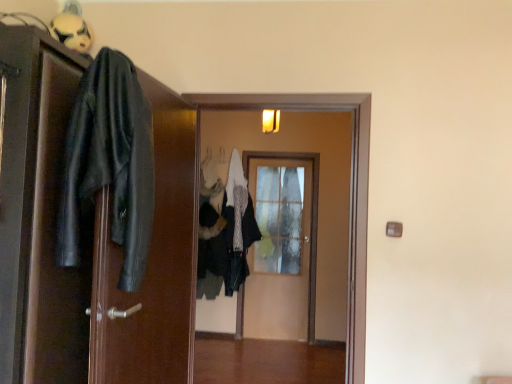
The image size is (512, 384). I want to click on black leather jacket at left, so click(x=152, y=263).

The height and width of the screenshot is (384, 512). Describe the element at coordinates (281, 249) in the screenshot. I see `wooden glass door at center, which ranks as the first door in back-to-front order` at that location.

Locate an element on the screen. The image size is (512, 384). white matte mask at upper left is located at coordinates [x=71, y=28].

Where is `white textured coat at center, which is the 2th clothing in front-to-back order`? The image size is (512, 384). white textured coat at center, which is the 2th clothing in front-to-back order is located at coordinates (225, 232).

The height and width of the screenshot is (384, 512). What do you see at coordinates (225, 232) in the screenshot?
I see `white textured coat at center, the 1th clothing when ordered from back to front` at bounding box center [225, 232].

The height and width of the screenshot is (384, 512). I want to click on black leather jacket at left, so click(152, 263).

Can you confirm if black leather jacket at left, which is the 2th clothing in back-to-front order, is shorter than black leather jacket at left?

Yes.

Which of these two, black leather jacket at left, which ranks as the first clothing in left-to-right order, or black leather jacket at left, is wider?

black leather jacket at left, which ranks as the first clothing in left-to-right order.

Is black leather jacket at left, positioned as the 2th clothing in right-to-left order, positioned with its back to black leather jacket at left?

Yes.

Which object is further away from the camera, black leather jacket at left, which ranks as the first clothing in left-to-right order, or black leather jacket at left?

black leather jacket at left.

Considering the positions of objects black leather jacket at left, the 1th door positioned from the left, and white matte mask at upper left in the image provided, who is more to the right, black leather jacket at left, the 1th door positioned from the left, or white matte mask at upper left?

From the viewer's perspective, black leather jacket at left, the 1th door positioned from the left, appears more on the right side.

Is black leather jacket at left, which is the third door from back to front, oriented towards white matte mask at upper left?

No, black leather jacket at left, which is the third door from back to front, is not oriented towards white matte mask at upper left.

Could you measure the distance between black leather jacket at left, the first door from the front, and white matte mask at upper left?

They are 3.40 feet apart.

Is black leather jacket at left, the first door from the front, taller or shorter than white matte mask at upper left?

Considering their sizes, black leather jacket at left, the first door from the front, has more height than white matte mask at upper left.

Is there a large distance between black leather jacket at left, the first door from the front, and black leather jacket at left, which is the 2th clothing in back-to-front order?

No, black leather jacket at left, the first door from the front, is in close proximity to black leather jacket at left, which is the 2th clothing in back-to-front order.

In the scene shown: From a real-world perspective, between black leather jacket at left, the 3th door positioned from the right, and black leather jacket at left, the 1th clothing positioned from the front, who is vertically higher?

black leather jacket at left, the 1th clothing positioned from the front, from a real-world perspective.

Is black leather jacket at left, the 3th door positioned from the right, in front of or behind black leather jacket at left, positioned as the 2th clothing in right-to-left order, in the image?

black leather jacket at left, the 3th door positioned from the right, is positioned closer to the viewer than black leather jacket at left, positioned as the 2th clothing in right-to-left order.

Is black leather jacket at left, the 1th door positioned from the left, wider or thinner than black leather jacket at left, the 1th clothing positioned from the front?

black leather jacket at left, the 1th door positioned from the left, is wider than black leather jacket at left, the 1th clothing positioned from the front.

Can you tell me how much white textured coat at center, the 1th clothing when ordered from back to front, and black leather jacket at left differ in facing direction?

The facing directions of white textured coat at center, the 1th clothing when ordered from back to front, and black leather jacket at left are 84.4 degrees apart.

What are the coordinates of `clothing below the black leather jacket at left (from the image's perspective)` in the screenshot? It's located at (225, 232).

From a real-world perspective, is white textured coat at center, which appears as the 1th clothing when viewed from the right, above or below black leather jacket at left?

Clearly, from a real-world perspective, white textured coat at center, which appears as the 1th clothing when viewed from the right, is below black leather jacket at left.

Find the location of a particular element. Image resolution: width=512 pixels, height=384 pixels. figurine behind the black leather jacket at left, which is the 2th clothing in back-to-front order is located at coordinates (71, 28).

Is black leather jacket at left, which ranks as the first clothing in left-to-right order, in front of white matte mask at upper left?

Yes.

Does black leather jacket at left, the 1th clothing positioned from the front, appear on the left side of white matte mask at upper left?

No, black leather jacket at left, the 1th clothing positioned from the front, is not to the left of white matte mask at upper left.

From the picture: Which object is positioned more to the left, black leather jacket at left or white matte mask at upper left?

white matte mask at upper left.

From the picture: From a real-world perspective, which object stands above the other?

In real-world perspective, white matte mask at upper left is above.

Is black leather jacket at left bigger or smaller than white matte mask at upper left?

Clearly, black leather jacket at left is larger in size than white matte mask at upper left.

Considering the points (189, 186) and (82, 37), which point is behind, point (189, 186) or point (82, 37)?

Positioned behind is point (189, 186).

From a real-world perspective, is wooden door at center, which ranks as the 2th door in right-to-left order, above or below black leather jacket at left, which is the third door from back to front?

wooden door at center, which ranks as the 2th door in right-to-left order, is above black leather jacket at left, which is the third door from back to front.

Which of these two, wooden door at center, the 2th door in the back-to-front sequence, or black leather jacket at left, the first door from the front, stands taller?

Standing taller between the two is wooden door at center, the 2th door in the back-to-front sequence.

How many degrees apart are the facing directions of wooden door at center, placed as the 2th door when sorted from front to back, and black leather jacket at left, the 1th door positioned from the left?

88 degrees.

Is wooden door at center, the 2th door in the back-to-front sequence, next to black leather jacket at left, the 3th door positioned from the right?

No, wooden door at center, the 2th door in the back-to-front sequence, is not with black leather jacket at left, the 3th door positioned from the right.

What are the coordinates of `screen door below the black leather jacket at left, which is the 2th clothing in back-to-front order (from the image's perspective)` in the screenshot? It's located at (152, 263).

Locate an element on the screen. figurine lying on the left of black leather jacket at left, the first door from the front is located at coordinates pos(71,28).

From the image, which object appears to be farther from black leather jacket at left, the 1th door positioned from the left, white textured coat at center, which is the second clothing in left-to-right order, or wooden door at center, placed as the 2th door when sorted from front to back?

The object further to black leather jacket at left, the 1th door positioned from the left, is wooden door at center, placed as the 2th door when sorted from front to back.

When comparing their distances from wooden door at center, which ranks as the 2th door in right-to-left order, does white textured coat at center, which is the second clothing in left-to-right order, or black leather jacket at left, which is the third door from back to front, seem closer?

The object closer to wooden door at center, which ranks as the 2th door in right-to-left order, is white textured coat at center, which is the second clothing in left-to-right order.

When comparing their distances from black leather jacket at left, does white textured coat at center, which is the second clothing in left-to-right order, or black leather jacket at left, the first door from the front, seem further?

Based on the image, white textured coat at center, which is the second clothing in left-to-right order, appears to be further to black leather jacket at left.

Consider the image. From the image, which object appears to be nearer to white matte mask at upper left, wooden glass door at center, which ranks as the 1th door in right-to-left order, or white textured coat at center, the 1th clothing when ordered from back to front?

white textured coat at center, the 1th clothing when ordered from back to front, is closer to white matte mask at upper left.

Estimate the real-world distances between objects in this image. Which object is closer to black leather jacket at left, wooden glass door at center, which ranks as the first door in back-to-front order, or white textured coat at center, which is the 2th clothing in front-to-back order?

white textured coat at center, which is the 2th clothing in front-to-back order, is positioned closer to the anchor black leather jacket at left.

Estimate the real-world distances between objects in this image. Which object is closer to black leather jacket at left, positioned as the 2th clothing in right-to-left order, white matte mask at upper left or black leather jacket at left, which is the third door from back to front?

black leather jacket at left, which is the third door from back to front, is positioned closer to the anchor black leather jacket at left, positioned as the 2th clothing in right-to-left order.

Estimate the real-world distances between objects in this image. Which object is closer to wooden glass door at center, which is the 3th door in left-to-right order, black leather jacket at left, the first door from the front, or black leather jacket at left?

black leather jacket at left.

When comparing their distances from wooden glass door at center, which ranks as the 1th door in right-to-left order, does black leather jacket at left, the 1th clothing positioned from the front, or white matte mask at upper left seem further?

black leather jacket at left, the 1th clothing positioned from the front, lies further to wooden glass door at center, which ranks as the 1th door in right-to-left order, than the other object.

Locate an element on the screen. door between black leather jacket at left, positioned as the 2th clothing in right-to-left order, and wooden glass door at center, which ranks as the first door in back-to-front order, along the z-axis is located at coordinates (319, 189).

Find the location of `clothing between black leather jacket at left and wooden glass door at center, which ranks as the 1th door in right-to-left order, along the z-axis`. clothing between black leather jacket at left and wooden glass door at center, which ranks as the 1th door in right-to-left order, along the z-axis is located at coordinates tap(225, 232).

Identify the location of clothing between black leather jacket at left, the first door from the front, and black leather jacket at left. (110, 164).

Where is `door positioned between black leather jacket at left and white textured coat at center, which appears as the 1th clothing when viewed from the right, from near to far`? This screenshot has width=512, height=384. door positioned between black leather jacket at left and white textured coat at center, which appears as the 1th clothing when viewed from the right, from near to far is located at coordinates (319, 189).